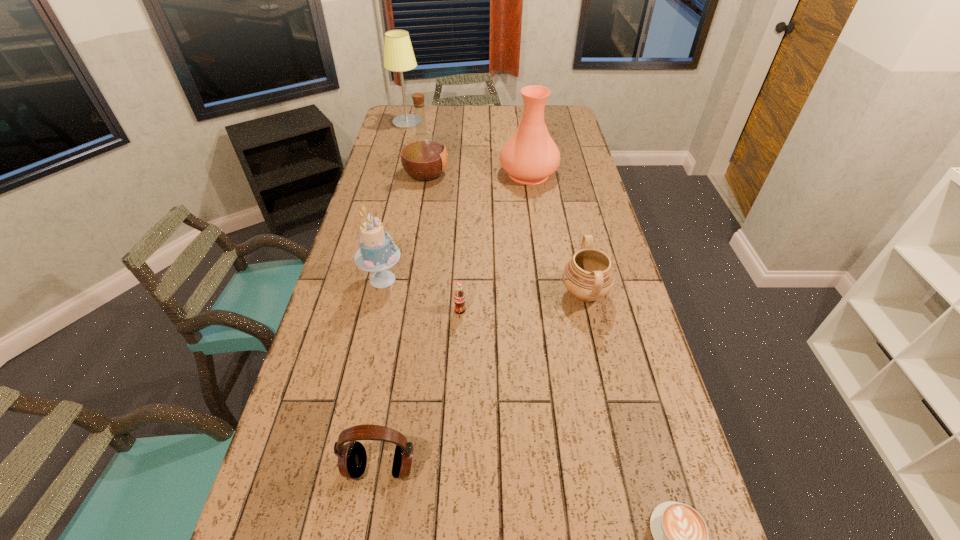
Locate an element on the screen. This screenshot has width=960, height=540. the farthest object is located at coordinates (398, 53).

What are the coordinates of `vase` in the screenshot? It's located at (530, 156).

This screenshot has height=540, width=960. What are the coordinates of `liquor` in the screenshot? It's located at (424, 157).

Locate an element on the screen. The height and width of the screenshot is (540, 960). the fifth shortest object is located at coordinates (378, 252).

Find the location of `headset`. headset is located at coordinates (352, 458).

At what (x,y) coordinates should I click in order to perform the action: click on urn. Please return your answer as a coordinate pair (x, y). This screenshot has width=960, height=540. Looking at the image, I should click on (588, 276).

The image size is (960, 540). Identify the location of soda. (459, 297).

Image resolution: width=960 pixels, height=540 pixels. Identify the location of the seventh tallest object. (459, 297).

I want to click on free location located on the front of the farthest object, so click(398, 157).

Locate an element on the screen. free space located on the back of the vase is located at coordinates (525, 147).